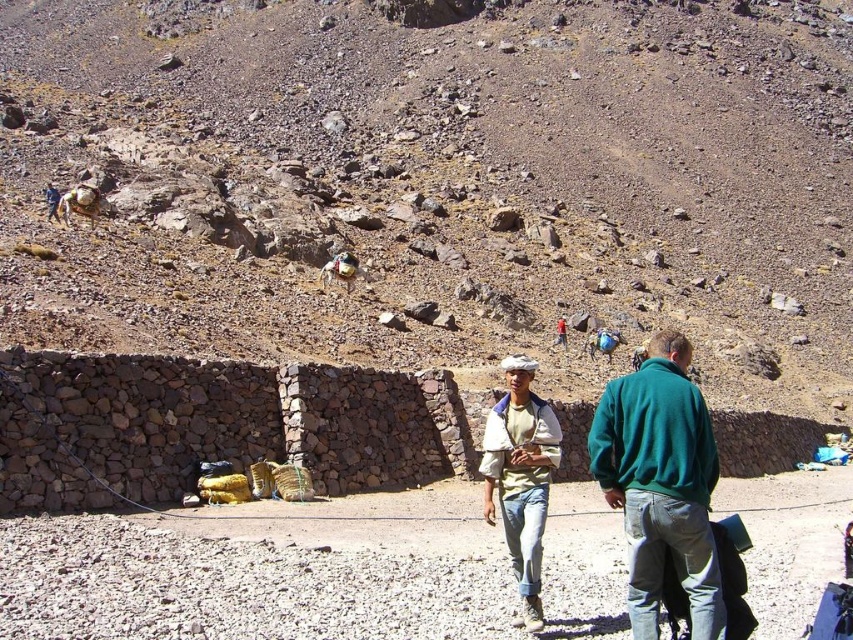
You are a photographer trying to capture a clear photo of the light beige cotton shirt at center and the brown fuzzy donkey at center. Which object should you focus on first to ensure both are in focus?

The light beige cotton shirt at center is in front of the brown fuzzy donkey at center, so you should focus on the light beige cotton shirt at center first to ensure both are in focus.

You are a photographer trying to capture a photo of the brown fuzzy donkey at center and the green fleece jacket at lower right. Which object is positioned more to the left side of the image?

The brown fuzzy donkey at center is positioned more to the left than the green fleece jacket at lower right.